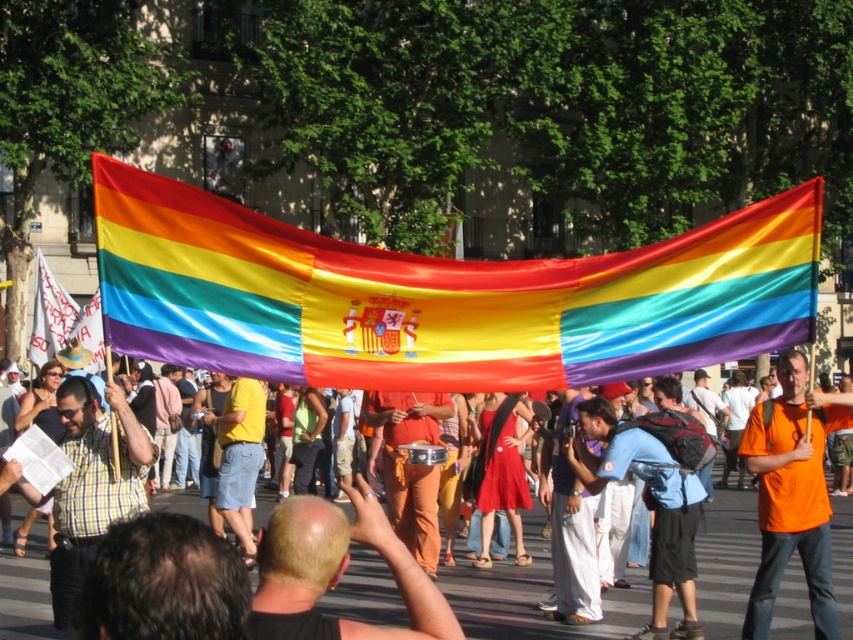
You are a photographer at the event and want to capture both the orange cotton shirt at center and the checkered fabric shirt at center in a single frame. Which shirt should you focus on first to ensure both are in the shot?

The orange cotton shirt at center has a lesser height compared to the checkered fabric shirt at center, so you should focus on the checkered fabric shirt at center first to ensure both are in the shot.

You are standing in the middle of the street during the event and see two points marked in the scene. The first point is at coordinates point (x=387, y=380) and the second is at point (x=73, y=470). Which point is closer to you?

Point (x=387, y=380) is in front of point (x=73, y=470), so it is closer to you.

You are attending a parade and want to wear a shirt that stands out more. Which shirt would be better to choose between the orange cotton shirt at center and the checkered fabric shirt at center?

The orange cotton shirt at center has a larger size compared to the checkered fabric shirt at center, so it would stand out more due to its bigger size.